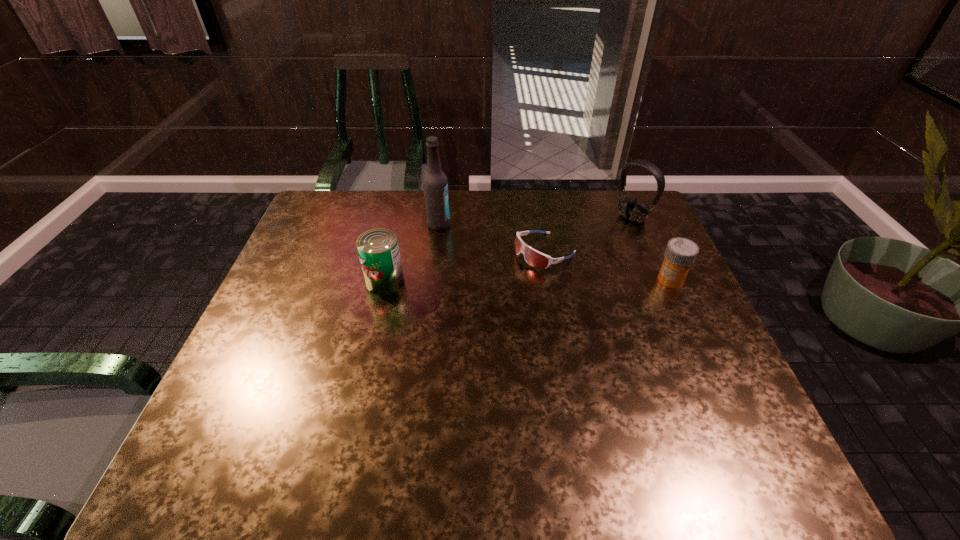
At what (x,y) coordinates should I click in order to perform the action: click on can. Please return your answer as a coordinate pair (x, y). Image resolution: width=960 pixels, height=540 pixels. Looking at the image, I should click on (378, 249).

Locate an element on the screen. the third shortest object is located at coordinates (378, 249).

This screenshot has width=960, height=540. In order to click on medicine in this screenshot , I will do `click(680, 254)`.

Identify the location of the fourth shortest object. (628, 208).

Find the location of a particular element. This screenshot has height=540, width=960. the third object from left to right is located at coordinates (534, 258).

Image resolution: width=960 pixels, height=540 pixels. In order to click on the shortest object in this screenshot , I will do `click(534, 258)`.

Identify the location of beer bottle. (435, 185).

The width and height of the screenshot is (960, 540). Identify the location of the fourth object from right to left. (435, 185).

The image size is (960, 540). I want to click on vacant space located on the back of the can, so click(x=393, y=246).

This screenshot has height=540, width=960. I want to click on blank area located on the label side of the medicine, so click(x=636, y=279).